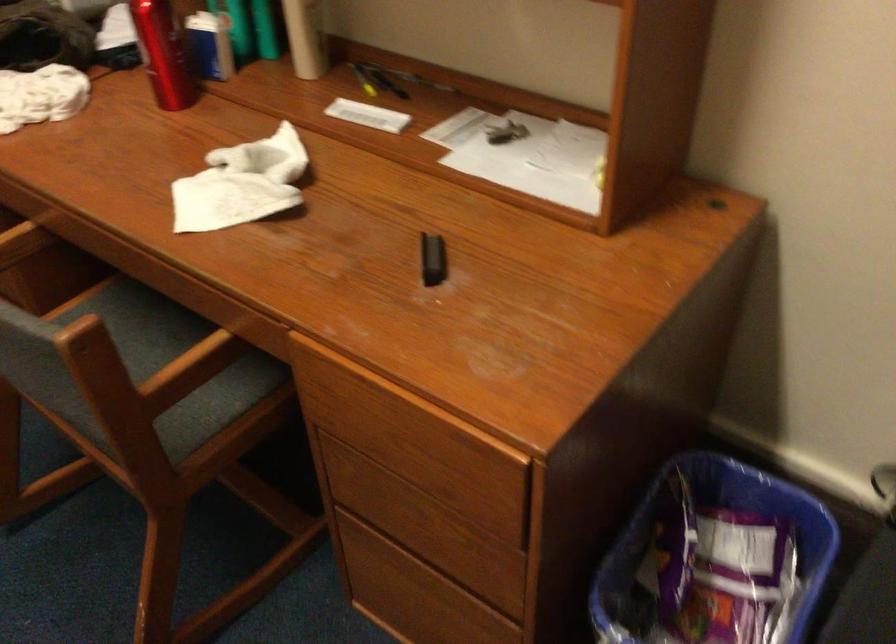
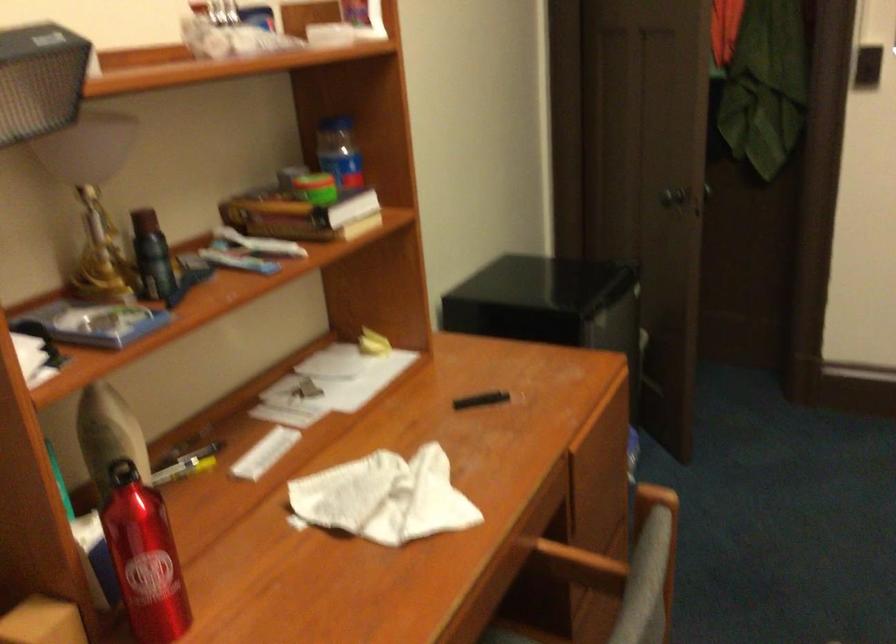
Where in the second image is the point corresponding to point 222,162 from the first image?

(383, 498)